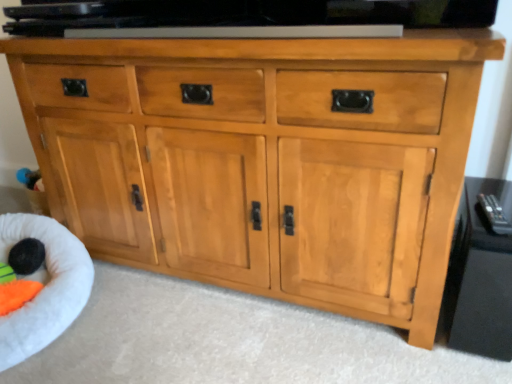
At what (x,y) coordinates should I click in order to perform the action: click on free region on the left part of glossy black tv stand at right. Please return your answer as a coordinate pair (x, y). This screenshot has width=512, height=384. Looking at the image, I should click on (384, 347).